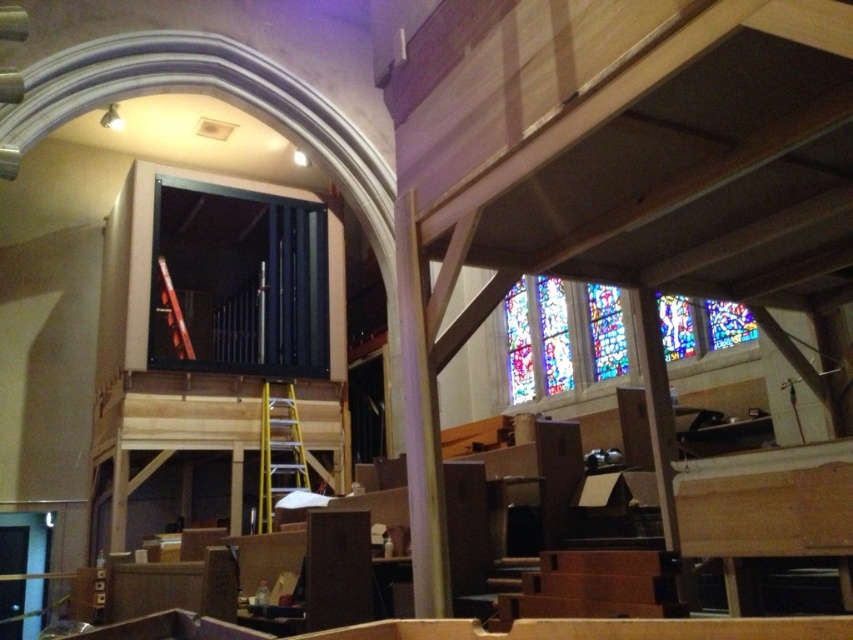
Question: Does yellow metallic ladder at center come in front of metallic yellow ladder at center?

Choices:
 (A) no
 (B) yes

Answer: (B)

Question: Can you confirm if yellow metallic ladder at center is positioned below metallic yellow ladder at center?

Choices:
 (A) yes
 (B) no

Answer: (A)

Question: Does yellow metallic ladder at center come behind metallic yellow ladder at center?

Choices:
 (A) yes
 (B) no

Answer: (B)

Question: Which point is closer to the camera?

Choices:
 (A) (258, 515)
 (B) (184, 333)

Answer: (A)

Question: Which point is closer to the camera taking this photo?

Choices:
 (A) (260, 483)
 (B) (165, 260)

Answer: (A)